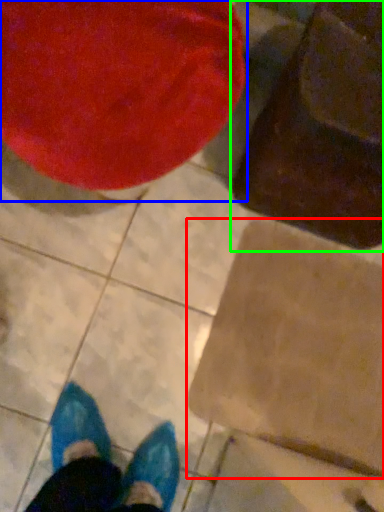
Question: Considering the real-world distances, which object is farthest from cardboard box (highlighted by a red box)? bean bag chair (highlighted by a blue box) or bean bag chair (highlighted by a green box)?

Choices:
 (A) bean bag chair
 (B) bean bag chair

Answer: (A)